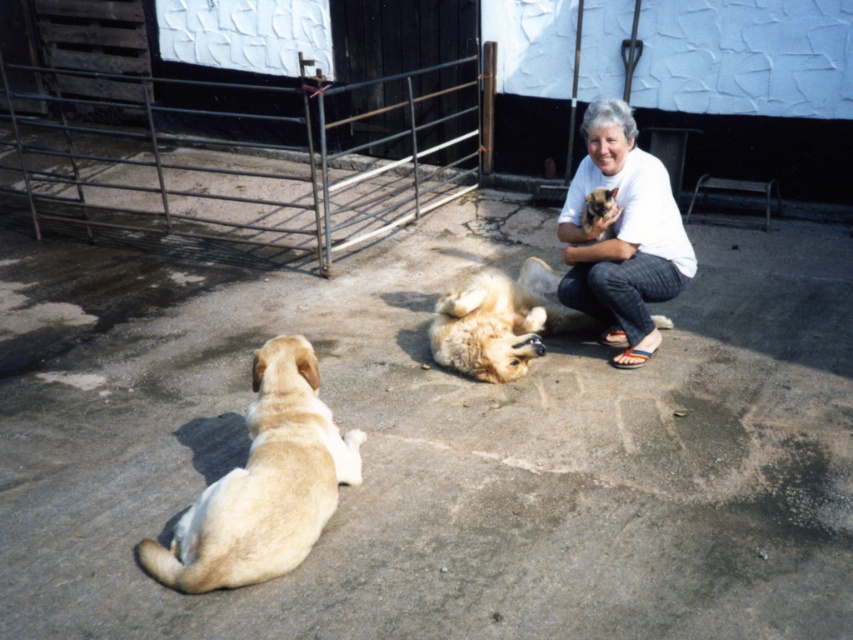
Who is positioned more to the left, white cotton shirt at upper right or golden fur dog at center?

golden fur dog at center

Looking at this image, is white cotton shirt at upper right to the right of golden fur dog at center from the viewer's perspective?

Correct, you'll find white cotton shirt at upper right to the right of golden fur dog at center.

Who is more forward, (645, 152) or (532, 260)?

Point (645, 152) is more forward.

I want to click on white cotton shirt at upper right, so click(622, 236).

Between light brown fur at lower left and golden fur dog at center, which one is positioned higher?

golden fur dog at center

Describe the element at coordinates (264, 483) in the screenshot. This screenshot has height=640, width=853. I see `light brown fur at lower left` at that location.

Describe the element at coordinates (264, 483) in the screenshot. Image resolution: width=853 pixels, height=640 pixels. I see `light brown fur at lower left` at that location.

The image size is (853, 640). Find the location of `light brown fur at lower left`. light brown fur at lower left is located at coordinates (264, 483).

Does light brown fur at lower left appear over white cotton shirt at upper right?

No.

Is point (310, 387) closer to viewer compared to point (618, 332)?

Yes.

The width and height of the screenshot is (853, 640). What are the coordinates of `light brown fur at lower left` in the screenshot? It's located at (264, 483).